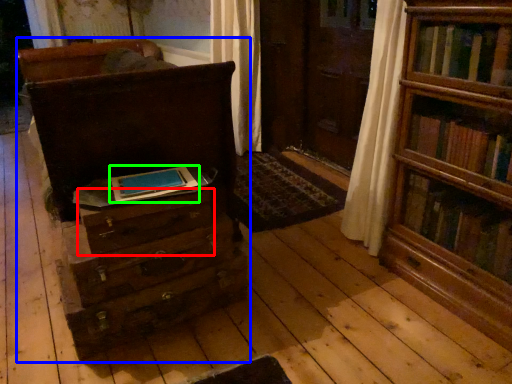
Question: Estimate the real-world distances between objects in this image. Which object is farther from drawer (highlighted by a red box), chest of drawers (highlighted by a blue box) or paperback book (highlighted by a green box)?

Choices:
 (A) chest of drawers
 (B) paperback book

Answer: (A)